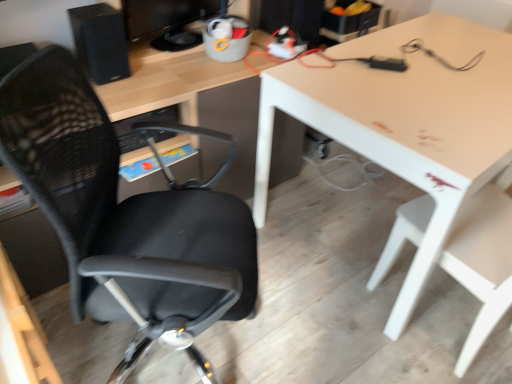
Question: In terms of size, does black mesh office chair at left, the first chair viewed from the left, appear bigger or smaller than white plastic chair at lower right, which appears as the 1th chair when viewed from the right?

Choices:
 (A) big
 (B) small

Answer: (A)

Question: Is black mesh office chair at left, the first chair viewed from the left, in front of or behind white plastic chair at lower right, which appears as the 1th chair when viewed from the right, in the image?

Choices:
 (A) behind
 (B) front

Answer: (B)

Question: Estimate the real-world distances between objects in this image. Which object is closer to the white glossy table at upper right?

Choices:
 (A) white plastic chair at lower right, the second chair positioned from the left
 (B) matte black monitor at upper center
 (C) black mesh office chair at left, the 2th chair when ordered from right to left
 (D) black matte speaker at upper left

Answer: (A)

Question: Which is nearer to the white plastic chair at lower right, which appears as the 1th chair when viewed from the right?

Choices:
 (A) black mesh office chair at left, the 2th chair when ordered from right to left
 (B) matte black monitor at upper center
 (C) white glossy table at upper right
 (D) black matte speaker at upper left

Answer: (C)